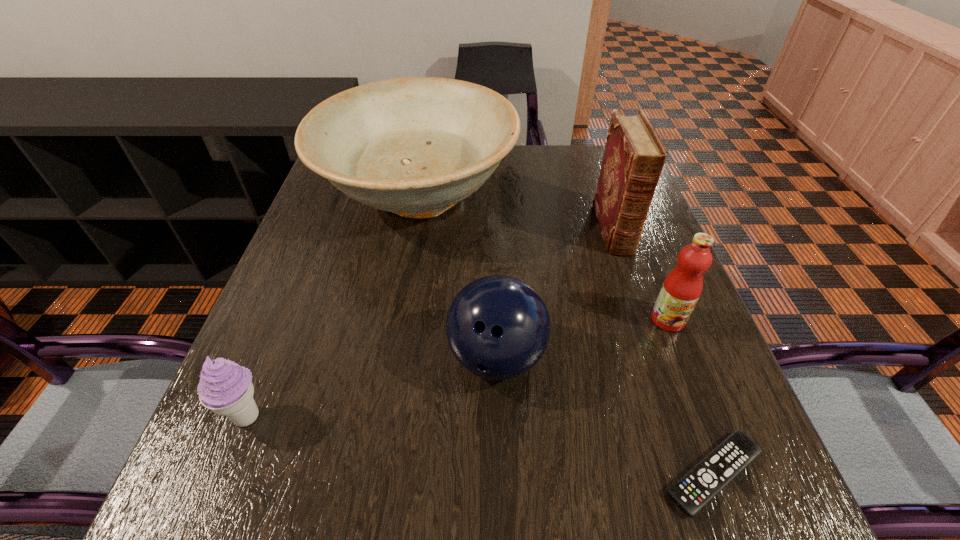
I want to click on object that is positioned at the near right corner, so click(x=705, y=480).

You are a GUI agent. You are given a task and a screenshot of the screen. Output one action in this format:
    pyautogui.click(x=<x>, y=<y>)
    Task: Click on the free location at the near edge
    The height and width of the screenshot is (540, 960).
    Given the screenshot: What is the action you would take?
    pyautogui.click(x=490, y=496)

Locate an element on the screen. vacant space at the left edge of the desktop is located at coordinates (365, 214).

Image resolution: width=960 pixels, height=540 pixels. I want to click on free region at the right edge of the desktop, so click(x=646, y=261).

Find the location of a particular element. vacant space at the far right corner of the desktop is located at coordinates (586, 150).

Locate an element on the screen. This screenshot has height=540, width=960. free point between the hardback book and the dish is located at coordinates (516, 213).

The width and height of the screenshot is (960, 540). I want to click on vacant space in between the dish and the hardback book, so click(x=516, y=213).

The height and width of the screenshot is (540, 960). I want to click on free space between the bowling ball and the remote control, so coord(605,415).

At what (x,y) coordinates should I click in order to perform the action: click on empty space that is in between the bowling ball and the shortest object. Please return your answer as a coordinate pair (x, y). This screenshot has height=540, width=960. Looking at the image, I should click on tap(605, 415).

Where is `vacant space that's between the shortest object and the bowling ball`? The height and width of the screenshot is (540, 960). vacant space that's between the shortest object and the bowling ball is located at coordinates (605, 415).